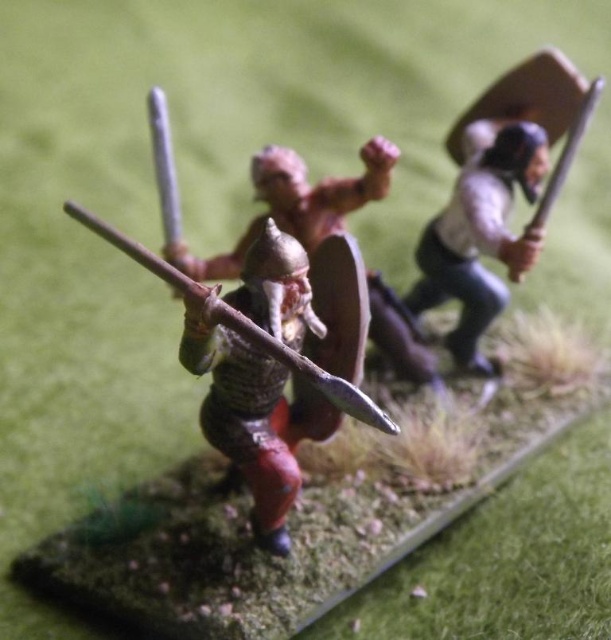
Who is positioned more to the left, white matte shield at upper right or wooden shield at upper right?

Positioned to the left is white matte shield at upper right.

Is white matte shield at upper right positioned behind wooden shield at upper right?

Yes.

Which is in front, point (458, 205) or point (571, 164)?

Point (571, 164) is more forward.

Where is `white matte shield at upper right`? The height and width of the screenshot is (640, 611). white matte shield at upper right is located at coordinates (480, 234).

Who is lower down, metallic armor at center or wooden shield at upper right?

Positioned lower is metallic armor at center.

Does metallic armor at center appear over wooden shield at upper right?

Actually, metallic armor at center is below wooden shield at upper right.

Which is behind, point (323, 330) or point (595, 81)?

The point (595, 81) is behind.

Where is `metallic armor at center`? metallic armor at center is located at coordinates (244, 416).

Who is more distant from viewer, [277,500] or [260,333]?

The point [277,500] is behind.

Is metallic armor at center above metallic spear at center?

No, metallic armor at center is not above metallic spear at center.

Find the location of a particular element. metallic armor at center is located at coordinates (244, 416).

Image resolution: width=611 pixels, height=640 pixels. Identify the location of metallic armor at center. (244, 416).